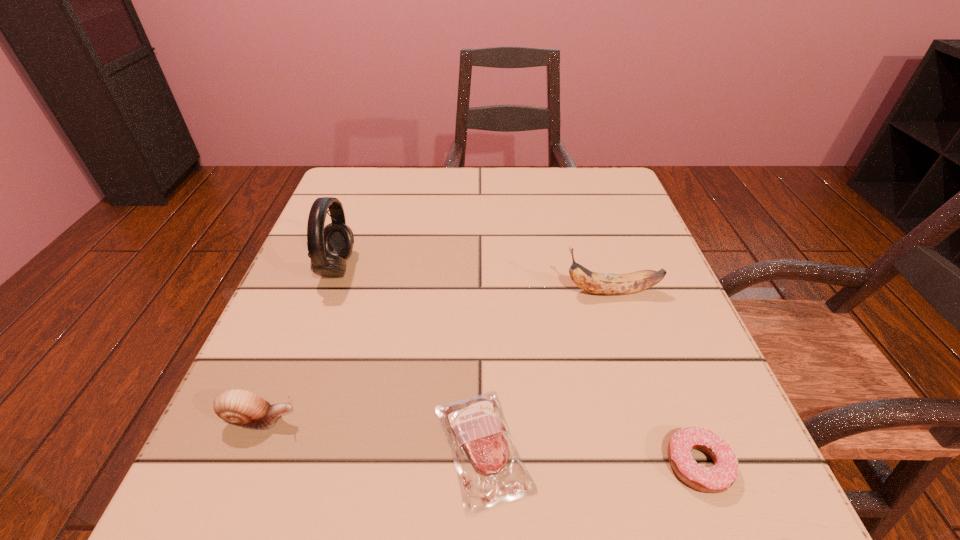
Where is `vacant space that is in between the banana and the doughnut`? This screenshot has height=540, width=960. vacant space that is in between the banana and the doughnut is located at coordinates (655, 378).

Where is `free area in between the banana and the tallest object`? free area in between the banana and the tallest object is located at coordinates (474, 279).

In order to click on empty space between the fourth shortest object and the third object from right to left in this screenshot , I will do `click(547, 370)`.

Identify the location of free point between the banana and the tallest object. (474, 279).

The height and width of the screenshot is (540, 960). Find the location of `vacant region between the tallest object and the fourth tallest object`. vacant region between the tallest object and the fourth tallest object is located at coordinates (517, 366).

Find the location of a particular element. This screenshot has width=960, height=540. object that stands as the third closest to the fourth shortest object is located at coordinates tap(328, 247).

This screenshot has height=540, width=960. I want to click on the third closest object relative to the fourth shortest object, so click(328, 247).

You are a GUI agent. You are given a task and a screenshot of the screen. Output one action in this format:
    pyautogui.click(x=<x>, y=<y>)
    Task: Click on the vacant region that satisfies the following two spatial constraints: 1. on the back side of the doughnut; 2. on the peel of the banana
    The image size is (960, 540).
    Given the screenshot: What is the action you would take?
    pyautogui.click(x=635, y=292)

I want to click on vacant space that satisfies the following two spatial constraints: 1. on the peel of the fourth shortest object; 2. on the front side of the shortest object, so click(660, 448).

The width and height of the screenshot is (960, 540). I want to click on free space that satisfies the following two spatial constraints: 1. on the earcups of the steak; 2. on the right side of the tallest object, so click(271, 448).